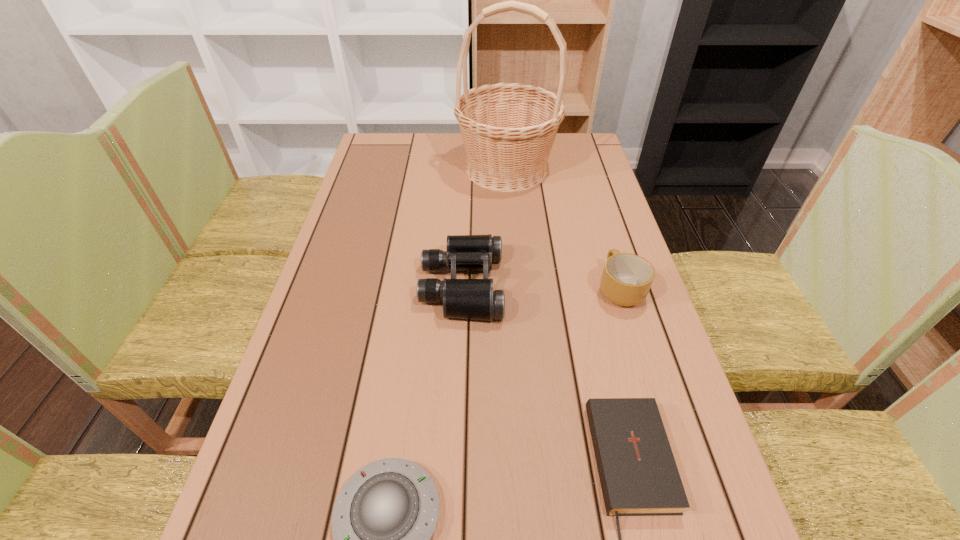
Locate an element on the screen. basket is located at coordinates (508, 129).

Where is `the tallest object`? Image resolution: width=960 pixels, height=540 pixels. the tallest object is located at coordinates (508, 129).

Image resolution: width=960 pixels, height=540 pixels. Identify the location of the second tallest object. (474, 299).

Locate an element on the screen. The image size is (960, 540). the third shortest object is located at coordinates (626, 279).

At what (x,y) coordinates should I click in order to perform the action: click on vacant space located on the left of the basket. Please return your answer as a coordinate pair (x, y). This screenshot has height=540, width=960. Looking at the image, I should click on (369, 169).

At what (x,y) coordinates should I click in order to perform the action: click on free space located on the front-facing side of the second tallest object. Please return your answer as a coordinate pair (x, y). The height and width of the screenshot is (540, 960). Looking at the image, I should click on (551, 285).

You are a GUI agent. You are given a task and a screenshot of the screen. Output one action in this format:
    pyautogui.click(x=<x>, y=<y>)
    Task: Click on the free point located 0.190m on the side with the handle of the third shortest object
    This screenshot has height=540, width=960.
    Given the screenshot: What is the action you would take?
    pyautogui.click(x=599, y=221)

At what (x,y) coordinates should I click in order to perform the action: click on vacant space positioned on the side with the handle of the third shortest object. Please return your answer as a coordinate pair (x, y). Looking at the image, I should click on (603, 233).

Find the location of a particular element. This screenshot has width=960, height=540. vacant area located on the side with the handle of the third shortest object is located at coordinates [597, 215].

Where is `object located at the far edge`? Image resolution: width=960 pixels, height=540 pixels. object located at the far edge is located at coordinates (508, 129).